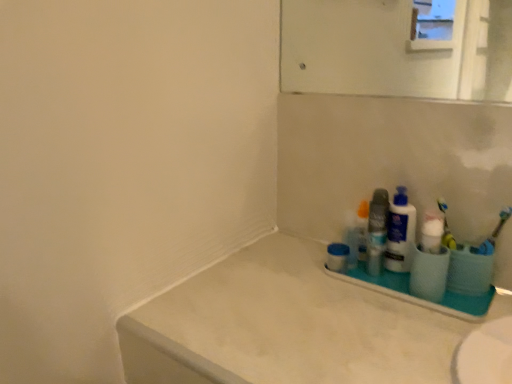
Identify the location of free point in front of white plastic bottle at right, which is the 2th cleaning product in front-to-back order. (412, 317).